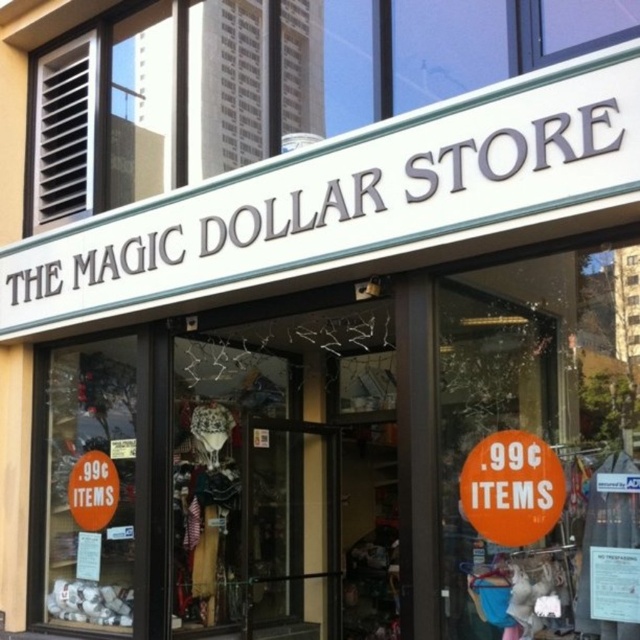
Can you confirm if orange matte sign at lower right is positioned above orange paper sign at lower left?

Indeed, orange matte sign at lower right is positioned over orange paper sign at lower left.

Between orange matte sign at lower right and orange paper sign at lower left, which one appears on the left side from the viewer's perspective?

orange paper sign at lower left

Which is in front, point (509, 516) or point (97, 522)?

Point (509, 516) is in front.

Locate an element on the screen. The height and width of the screenshot is (640, 640). orange matte sign at lower right is located at coordinates (512, 488).